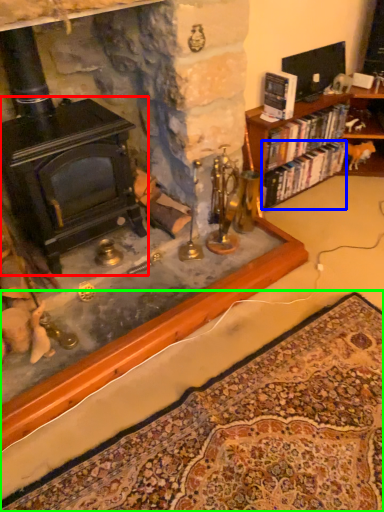
Question: Estimate the real-world distances between objects in this image. Which object is farther from fireplace (highlighted by a red box), book (highlighted by a blue box) or mat (highlighted by a green box)?

Choices:
 (A) book
 (B) mat

Answer: (A)